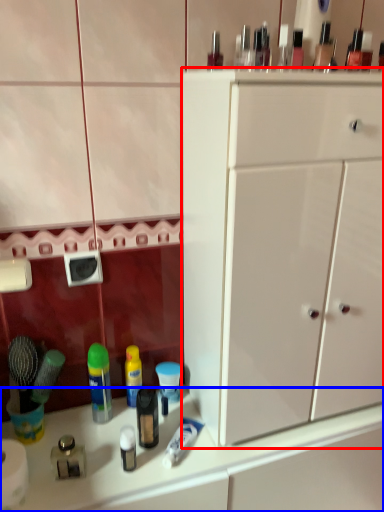
Question: Which object is further to the camera taking this photo, cabinetry (highlighted by a red box) or counter top (highlighted by a blue box)?

Choices:
 (A) cabinetry
 (B) counter top

Answer: (B)